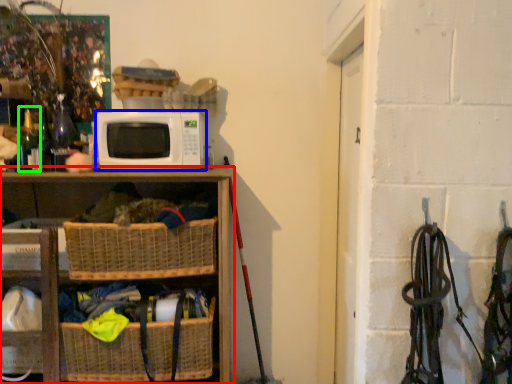
Question: Which object is the closest to the shelf (highlighted by a red box)? Choose among these: microwave oven (highlighted by a blue box) or bottle (highlighted by a green box).

Choices:
 (A) microwave oven
 (B) bottle

Answer: (A)